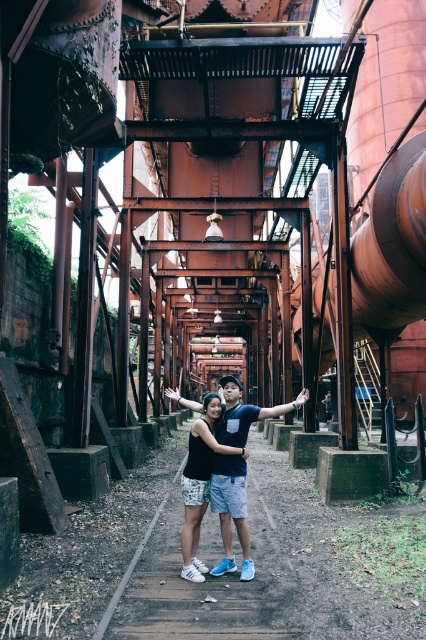
Which is above, matte black tank top at center or black matte shirt at center?

black matte shirt at center is higher up.

Which is more to the left, matte black tank top at center or black matte shirt at center?

matte black tank top at center is more to the left.

Is point (193, 492) farther from camera compared to point (206, 433)?

That is True.

The height and width of the screenshot is (640, 426). I want to click on matte black tank top at center, so click(206, 444).

Who is lower down, matte black t-shirt at center or matte black tank top at center?

matte black t-shirt at center is lower down.

The image size is (426, 640). I want to click on matte black t-shirt at center, so click(230, 512).

Measure the distance between matte black t-shirt at center and matte black arm at center.

The distance of matte black t-shirt at center from matte black arm at center is 8.52 feet.

Is point (244, 404) in front of point (261, 417)?

No, (244, 404) is further to viewer.

Looking at this image, who is more forward, (218, 440) or (307, 388)?

Point (218, 440)

Locate an element on the screen. matte black t-shirt at center is located at coordinates (230, 512).